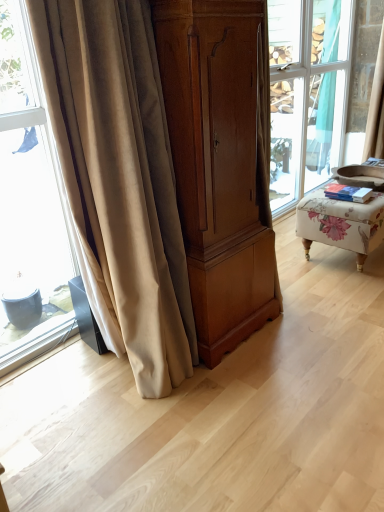
In order to click on free point in front of matte wood cabinet at center in this screenshot , I will do `click(249, 390)`.